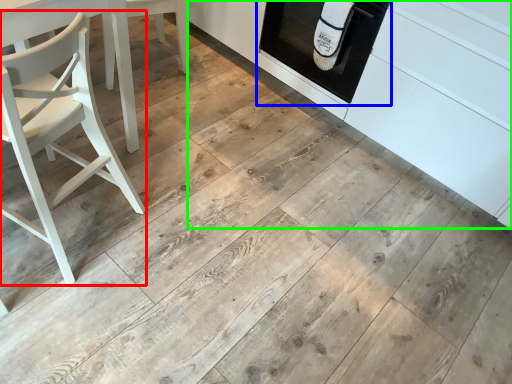
Question: Estimate the real-world distances between objects in this image. Which object is closer to chair (highlighted by a red box), oven (highlighted by a blue box) or cabinetry (highlighted by a green box)?

Choices:
 (A) oven
 (B) cabinetry

Answer: (A)